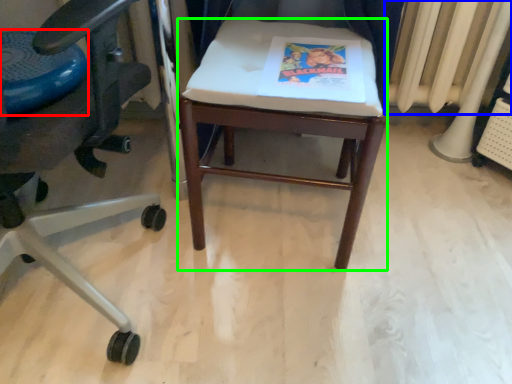
Question: Based on their relative distances, which object is farther from round table (highlighted by a red box)? Choose from radiator (highlighted by a blue box) and stool (highlighted by a green box).

Choices:
 (A) radiator
 (B) stool

Answer: (A)